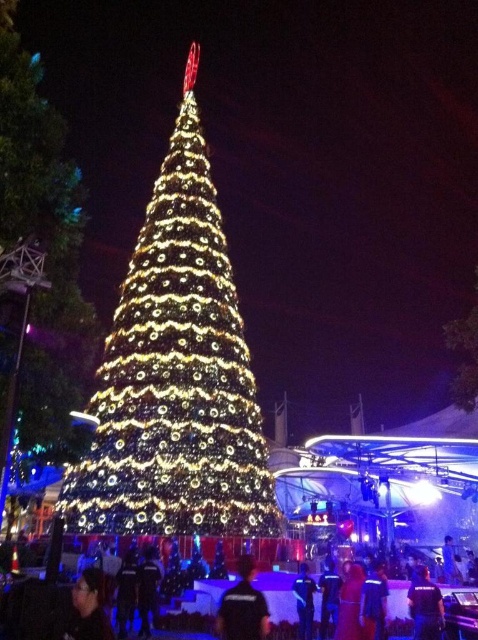
Question: Does black shirt at lower center have a lesser width compared to dark blue uniform at center?

Choices:
 (A) yes
 (B) no

Answer: (B)

Question: Which point is farther from the camera taking this photo?

Choices:
 (A) 434,588
 (B) 94,595
 (C) 236,598

Answer: (A)

Question: Is the position of black shirt at lower center less distant than that of dark blue shirt at center?

Choices:
 (A) yes
 (B) no

Answer: (A)

Question: Can you confirm if illuminated green pine at center is bigger than black matte glasses at lower left?

Choices:
 (A) no
 (B) yes

Answer: (B)

Question: Estimate the real-world distances between objects in this image. Which object is farther from the dark blue shirt at center?

Choices:
 (A) black shirt at lower center
 (B) illuminated green pine at center
 (C) dark blue uniform at center

Answer: (B)

Question: Which point appears farthest from the camera in this image?

Choices:
 (A) (247, 582)
 (B) (96, 568)
 (C) (412, 611)
 (D) (197, 337)

Answer: (D)